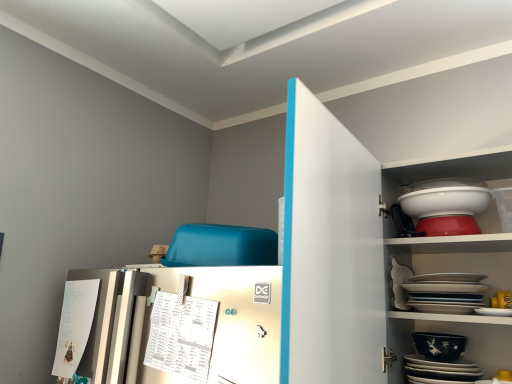
Question: Could you tell me if white glossy bowl at upper right, which is the first bowl in top-to-bottom order, is facing white glossy platter at upper right, the first platter when ordered from top to bottom?

Choices:
 (A) no
 (B) yes

Answer: (A)

Question: Can you confirm if white glossy bowl at upper right, the second bowl ordered from the bottom, is positioned to the right of white glossy platter at upper right, acting as the second platter starting from the bottom?

Choices:
 (A) no
 (B) yes

Answer: (B)

Question: From a real-world perspective, does white glossy bowl at upper right, which is the first bowl in top-to-bottom order, stand above white glossy platter at upper right, the first platter when ordered from top to bottom?

Choices:
 (A) yes
 (B) no

Answer: (A)

Question: Is white glossy bowl at upper right, which is the first bowl in top-to-bottom order, behind white glossy platter at upper right, acting as the second platter starting from the bottom?

Choices:
 (A) no
 (B) yes

Answer: (B)

Question: Is there a large distance between white glossy bowl at upper right, the second bowl ordered from the bottom, and white glossy platter at upper right, the first platter when ordered from top to bottom?

Choices:
 (A) yes
 (B) no

Answer: (B)

Question: Looking at the image, does black glossy platter at lower right, which ranks as the 1th platter in bottom-to-top order, seem bigger or smaller compared to white glossy platter at upper right, acting as the second platter starting from the bottom?

Choices:
 (A) small
 (B) big

Answer: (B)

Question: Considering the positions of point (429, 375) and point (445, 279), is point (429, 375) closer or farther from the camera than point (445, 279)?

Choices:
 (A) farther
 (B) closer

Answer: (A)

Question: Do you think black glossy platter at lower right, which ranks as the 1th platter in bottom-to-top order, is within white glossy platter at upper right, the first platter when ordered from top to bottom, or outside of it?

Choices:
 (A) outside
 (B) inside

Answer: (A)

Question: From the image's perspective, is black glossy platter at lower right, which ranks as the 1th platter in bottom-to-top order, located above or below white glossy platter at upper right, the first platter when ordered from top to bottom?

Choices:
 (A) above
 (B) below

Answer: (B)

Question: From their relative heights in the image, would you say white glossy platter at upper right, acting as the second platter starting from the bottom, is taller or shorter than white glossy bowl at upper right, which is the first bowl in top-to-bottom order?

Choices:
 (A) short
 (B) tall

Answer: (B)

Question: Considering the relative positions of white glossy platter at upper right, acting as the second platter starting from the bottom, and white glossy bowl at upper right, which is the first bowl in top-to-bottom order, in the image provided, is white glossy platter at upper right, acting as the second platter starting from the bottom, to the left or to the right of white glossy bowl at upper right, which is the first bowl in top-to-bottom order,?

Choices:
 (A) left
 (B) right

Answer: (A)

Question: From the image's perspective, is white glossy platter at upper right, the first platter when ordered from top to bottom, above or below white glossy bowl at upper right, which is the first bowl in top-to-bottom order?

Choices:
 (A) below
 (B) above

Answer: (A)

Question: In terms of width, does white glossy platter at upper right, acting as the second platter starting from the bottom, look wider or thinner when compared to white glossy bowl at upper right, which is the first bowl in top-to-bottom order?

Choices:
 (A) thin
 (B) wide

Answer: (B)

Question: From their relative heights in the image, would you say black glossy bowl at lower right, placed as the 1th bowl when sorted from bottom to top, is taller or shorter than white glossy platter at upper right, the first platter when ordered from top to bottom?

Choices:
 (A) tall
 (B) short

Answer: (B)

Question: Is black glossy bowl at lower right, placed as the 1th bowl when sorted from bottom to top, wider or thinner than white glossy platter at upper right, acting as the second platter starting from the bottom?

Choices:
 (A) thin
 (B) wide

Answer: (A)